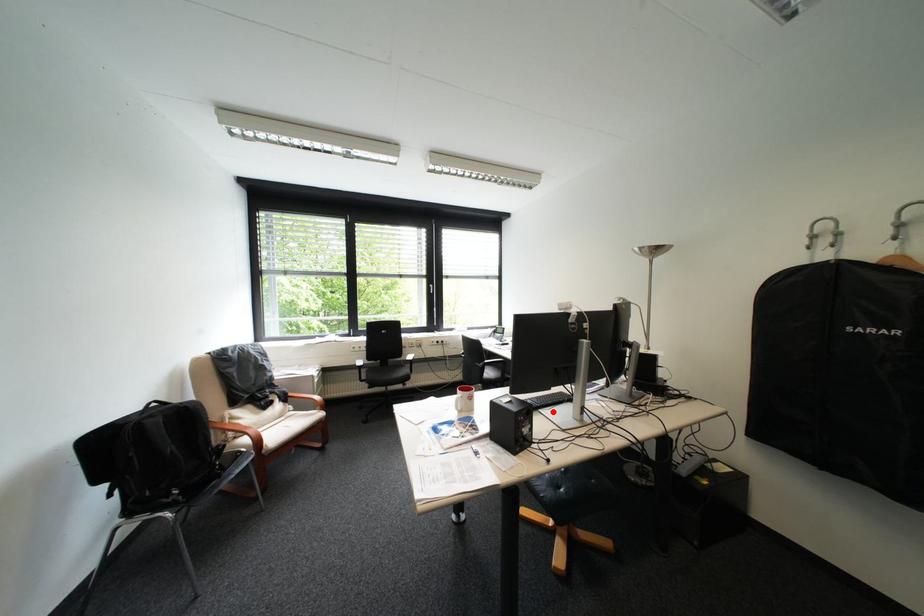
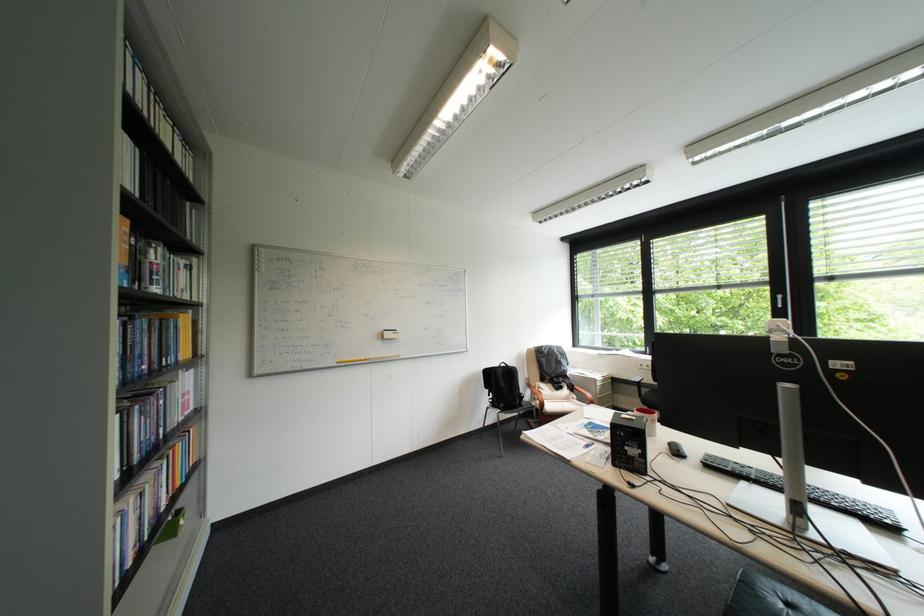
In the second image, find the point that corresponds to the highlighted location in the first image.

(757, 484)